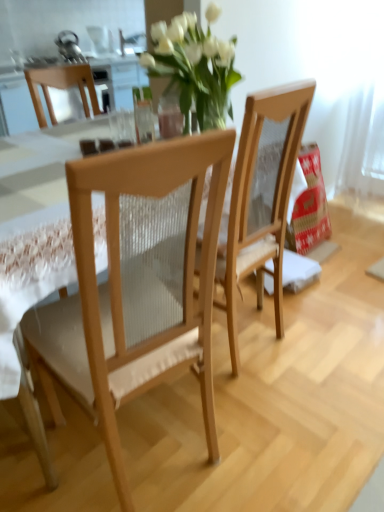
Identify the location of vacant region in front of natural wood chair at center, marked as the 1th chair in a right-to-left arrangement. This screenshot has width=384, height=512. (269, 399).